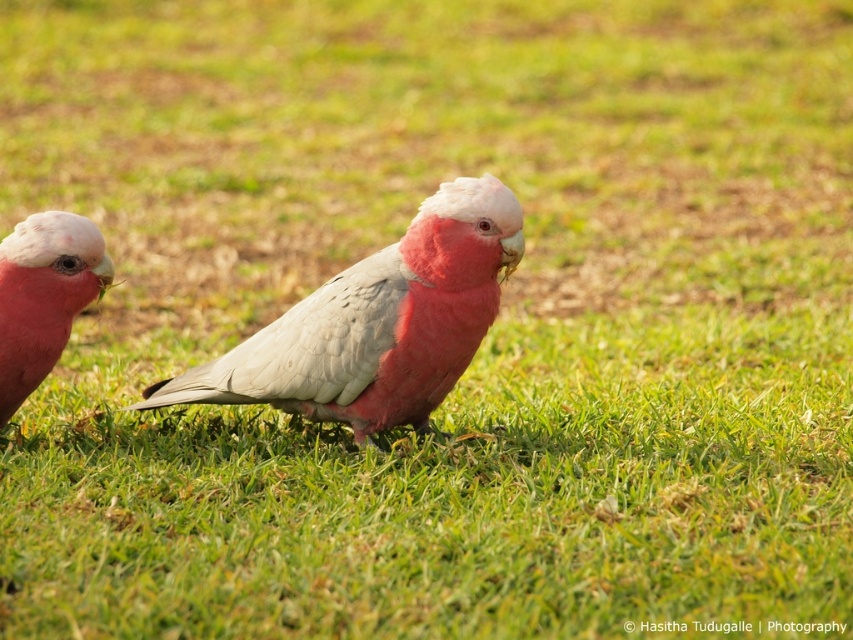
You are a birdwatcher observing two pink matte parrots in a grassy field. You notice the pink matte parrot at center and the pink matte parrot at left. Based on their positions, which parrot is closer to the ground?

The pink matte parrot at center is located below the pink matte parrot at left, meaning it is closer to the ground.

You are a photographer standing in a field and see the pink matte parrot at center. If you want to take a closer photo of it, do you need to move forward or backward?

The pink matte parrot at center is 2.97 meters from viewer. To take a closer photo, you need to move forward towards the pink matte parrot at center to reduce the distance.

You are a birdwatcher observing two points in the image where birds are located. The points are labeled as point 1 at coordinates point (401, 408) and point 2 at coordinates point (84, 248). Which point is closer to you?

Point 1 at coordinates point (401, 408) is closer to you because it is in front of point 2 at coordinates point (84, 248).